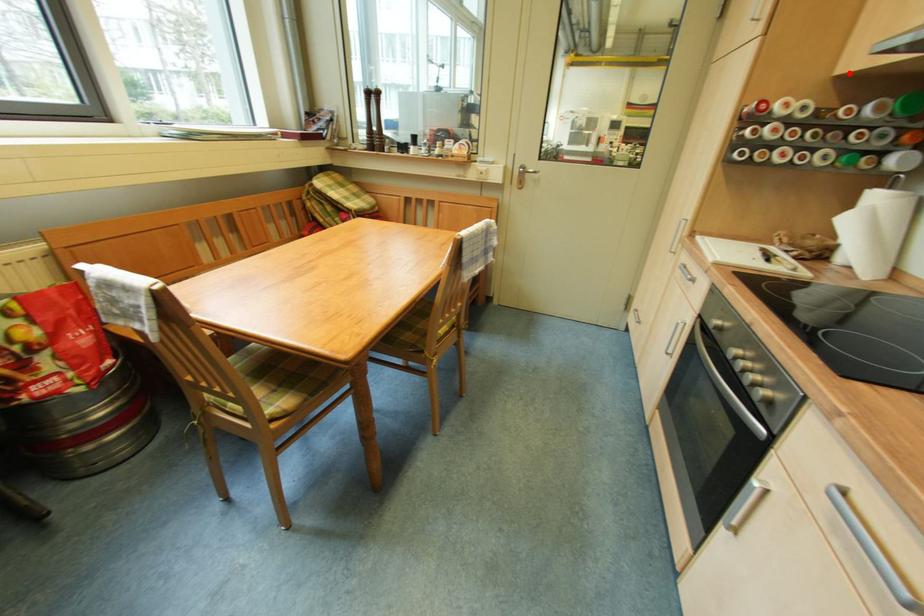
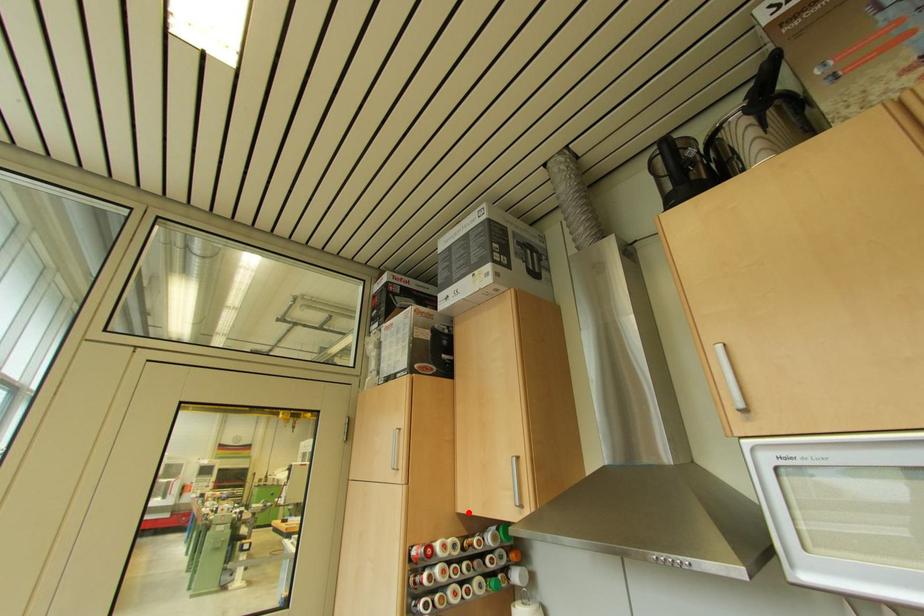
I am providing you with two images of the same scene from different viewpoints. A red point is marked on the first image and another point is marked on the second image. Do the highlighted points in image1 and image2 indicate the same real-world spot?

Yes